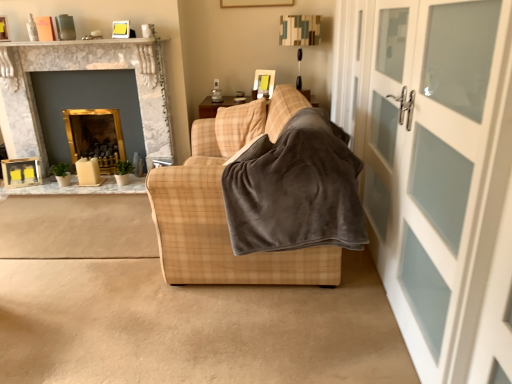
Question: Does gray fleece blanket at center have a lesser height compared to plaid fabric couch at center?

Choices:
 (A) yes
 (B) no

Answer: (A)

Question: Can you confirm if gray fleece blanket at center is smaller than plaid fabric couch at center?

Choices:
 (A) yes
 (B) no

Answer: (A)

Question: Is gray fleece blanket at center bigger than plaid fabric couch at center?

Choices:
 (A) yes
 (B) no

Answer: (B)

Question: Considering the relative sizes of gray fleece blanket at center and plaid fabric couch at center in the image provided, is gray fleece blanket at center wider than plaid fabric couch at center?

Choices:
 (A) yes
 (B) no

Answer: (B)

Question: Is gray fleece blanket at center oriented towards plaid fabric couch at center?

Choices:
 (A) no
 (B) yes

Answer: (B)

Question: From the image's perspective, is gray fleece blanket at center located above or below wooden table at left?

Choices:
 (A) below
 (B) above

Answer: (B)

Question: In the image, is gray fleece blanket at center positioned in front of or behind wooden table at left?

Choices:
 (A) behind
 (B) front

Answer: (B)

Question: Looking at their shapes, would you say gray fleece blanket at center is wider or thinner than wooden table at left?

Choices:
 (A) thin
 (B) wide

Answer: (B)

Question: In the image, is gray fleece blanket at center on the left side or the right side of wooden table at left?

Choices:
 (A) left
 (B) right

Answer: (B)

Question: Considering the positions of gray fleece blanket at center and white marble fireplace at upper center in the image, is gray fleece blanket at center bigger or smaller than white marble fireplace at upper center?

Choices:
 (A) big
 (B) small

Answer: (A)

Question: In the image, is gray fleece blanket at center positioned in front of or behind white marble fireplace at upper center?

Choices:
 (A) front
 (B) behind

Answer: (A)

Question: From the image's perspective, is gray fleece blanket at center above or below white marble fireplace at upper center?

Choices:
 (A) below
 (B) above

Answer: (A)

Question: Would you say gray fleece blanket at center is to the left or to the right of white marble fireplace at upper center in the picture?

Choices:
 (A) right
 (B) left

Answer: (A)

Question: In terms of size, does white frosted glass door at right appear bigger or smaller than gray fleece blanket at center?

Choices:
 (A) big
 (B) small

Answer: (B)

Question: Relative to gray fleece blanket at center, is white frosted glass door at right in front or behind?

Choices:
 (A) behind
 (B) front

Answer: (B)